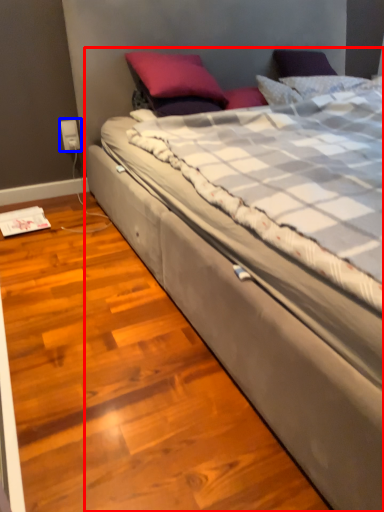
Question: Among these objects, which one is farthest to the camera, bed (highlighted by a red box) or electric outlet (highlighted by a blue box)?

Choices:
 (A) bed
 (B) electric outlet

Answer: (B)